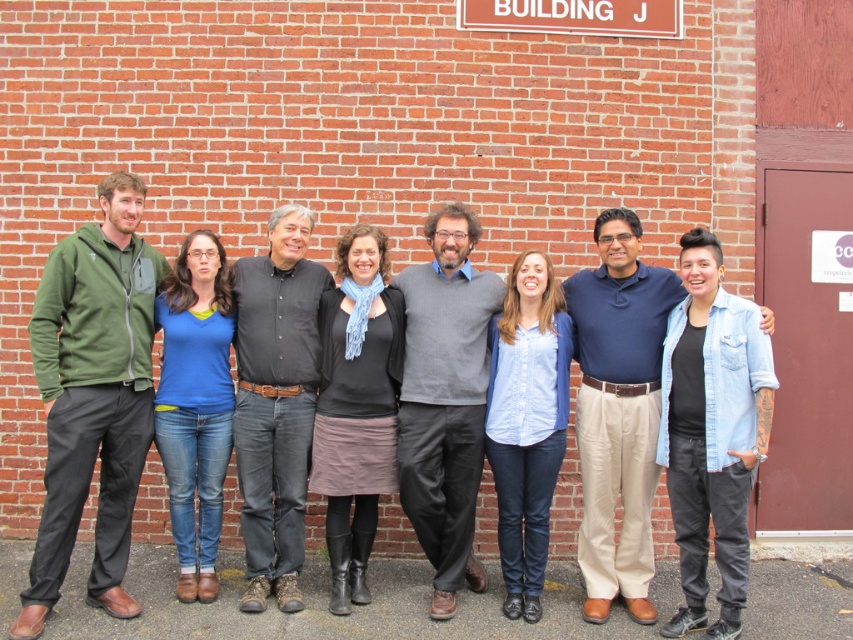
You are standing in front of the brick wall with the group. There is a point marked at coordinates (618, 410). What object is located at that point?

The blue shirt at center is located at point (618, 410).

From the picture: You are a photographer trying to adjust the framing of your shot. You notice two shirts in the center of the image, a blue shirt at center and a black cotton shirt at center. Which shirt should you focus on to ensure the wider one is centered in your frame?

The blue shirt at center has a larger width than the black cotton shirt at center, so you should focus on the blue shirt at center to ensure the wider one is centered in your frame.

You are a photographer setting up for a group photo. You need to ensure that the distance between the olive green fleece jacket at left and the blue shirt at center is at least 2 meters to frame the shot properly. Based on the scene description, can you confirm if this requirement is met?

The olive green fleece jacket at left and blue shirt at center are 2.49 meters apart, which is more than the required 2 meters. Therefore, the distance requirement is met.